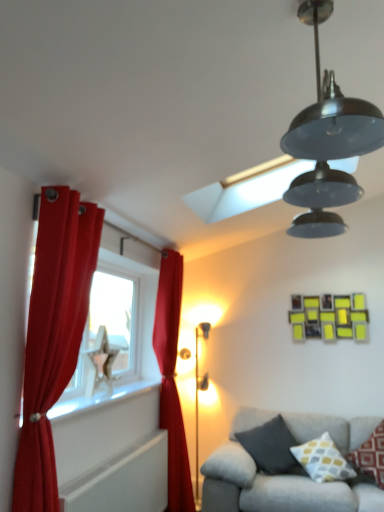
Question: Considering their positions, is gray fabric couch at lower right located in front of or behind red velvet curtain at center, which is counted as the second curtain, starting from the left?

Choices:
 (A) behind
 (B) front

Answer: (B)

Question: Considering the positions of gray fabric couch at lower right and red velvet curtain at center, which is counted as the first curtain, starting from the right, in the image, is gray fabric couch at lower right wider or thinner than red velvet curtain at center, which is counted as the first curtain, starting from the right,?

Choices:
 (A) wide
 (B) thin

Answer: (A)

Question: Which object is positioned closest to the satin red curtain at left, which is counted as the 1th curtain, starting from the left?

Choices:
 (A) yellow and gray patterned pillow at lower right, arranged as the 2th pillow when viewed from the left
 (B) white glossy window sill at lower left
 (C) red velvet curtain at center, which is counted as the first curtain, starting from the right
 (D) white textured radiator at lower left
 (E) gray fabric couch at lower right

Answer: (B)

Question: Which object is the closest to the gray fabric couch at lower right?

Choices:
 (A) dark gray fabric pillow at lower right, the first pillow from the left
 (B) white textured radiator at lower left
 (C) yellow and gray patterned pillow at lower right, arranged as the 2th pillow when viewed from the left
 (D) patterned fabric pillow at lower right, which is counted as the 3th pillow, starting from the left
 (E) satin red curtain at left, which is counted as the 1th curtain, starting from the left

Answer: (A)